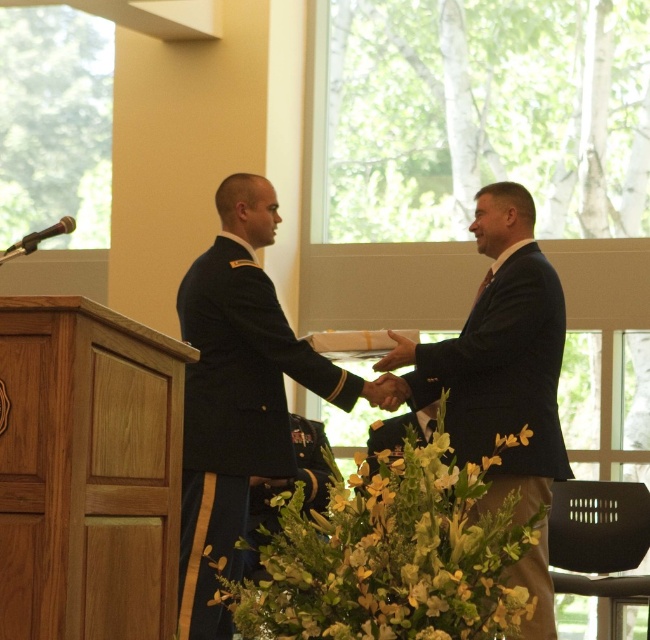
Question: Among these points, which one is nearest to the camera?

Choices:
 (A) (341, 484)
 (B) (231, 426)

Answer: (A)

Question: Which point is closer to the camera?

Choices:
 (A) (190, 388)
 (B) (514, 280)
 (C) (281, 604)

Answer: (C)

Question: Which of the following is the closest to the observer?

Choices:
 (A) (489, 292)
 (B) (339, 618)

Answer: (B)

Question: Is green leafy plant at center bigger than dark blue suit at center?

Choices:
 (A) no
 (B) yes

Answer: (A)

Question: Can you confirm if green leafy plant at center is wider than dark blue suit at center?

Choices:
 (A) no
 (B) yes

Answer: (B)

Question: Is navy blue fabric uniform at center to the right of dark blue suit at center from the viewer's perspective?

Choices:
 (A) yes
 (B) no

Answer: (B)